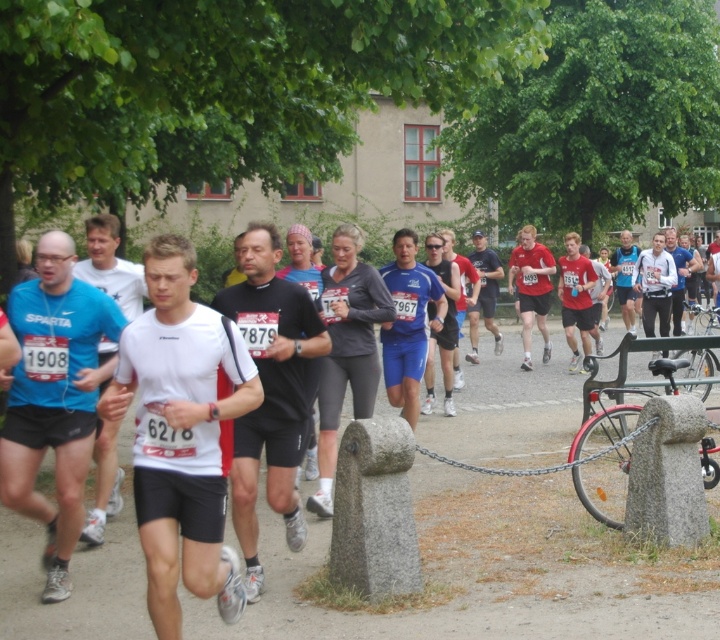
Question: Among these objects, which one is farthest from the camera?

Choices:
 (A) red metallic bicycle at lower right
 (B) silver metallic bicycle at right
 (C) black matte running shoe at center

Answer: (B)

Question: Among these objects, which one is nearest to the camera?

Choices:
 (A) silver metallic bicycle at right
 (B) red metallic bicycle at lower right

Answer: (B)

Question: Observing the image, what is the correct spatial positioning of black matte running shoe at center in reference to silver metallic bicycle at right?

Choices:
 (A) below
 (B) above

Answer: (A)

Question: Does black matte running shoe at center lie in front of silver metallic bicycle at right?

Choices:
 (A) no
 (B) yes

Answer: (B)

Question: Which point is farther to the camera?

Choices:
 (A) (598, 394)
 (B) (238, 452)

Answer: (A)

Question: From the image, what is the correct spatial relationship of red metallic bicycle at lower right in relation to silver metallic bicycle at right?

Choices:
 (A) below
 (B) above

Answer: (A)